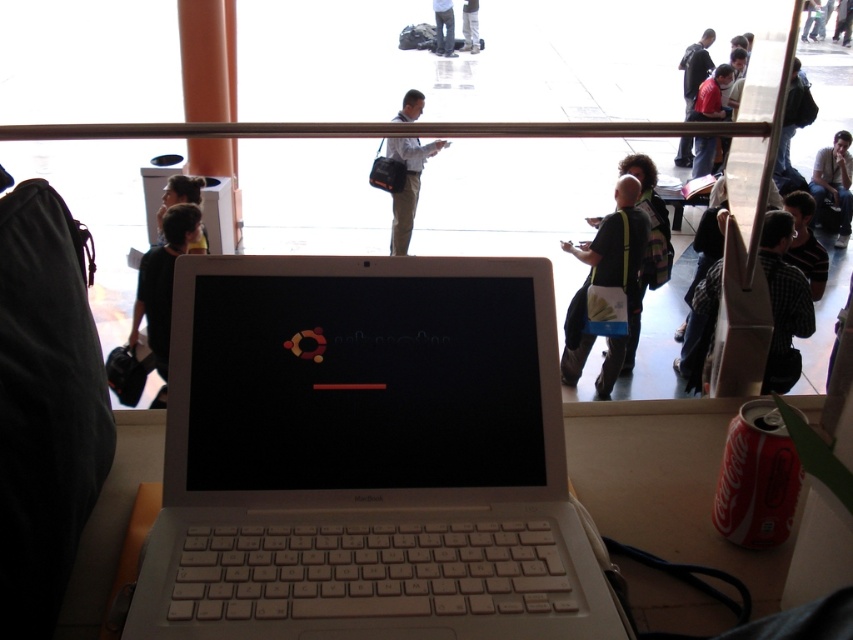
You are organizing a conference and need to place a 18 inch tall decoration between the black fabric bag at center and the dark blue shirt at center. Can you fit it there?

The black fabric bag at center is taller than the dark blue shirt at center. The tallest object between them is the black fabric bag at center. Since the decoration is 18 inches tall, it can be placed there as long as the available vertical space is sufficient. However, the description only provides information about their relative heights, not the actual vertical clearance. Without knowing the exact height of the black fabric bag at center or the space between them, it is uncertain if the 18 inch tall deco

You are organizing a photo shoot and need to place a mannequin wearing a black striped shirt at right and a mannequin wearing a dark blue shirt at center in the scene. Based on the image description, which mannequin requires a wider base to prevent tipping over?

The black striped shirt at right requires a wider base because its width is larger than the dark blue shirt at center, making it more prone to tipping over without proper support.

Looking at this image, you are attending a conference and see two people in the background of the image. One is wearing a black striped shirt at right and the other a dark blue shirt at center. If you want to approach the person closer to you, which one should you walk towards?

You should walk towards the black striped shirt at right because it is closer to the viewer than the dark blue shirt at center.